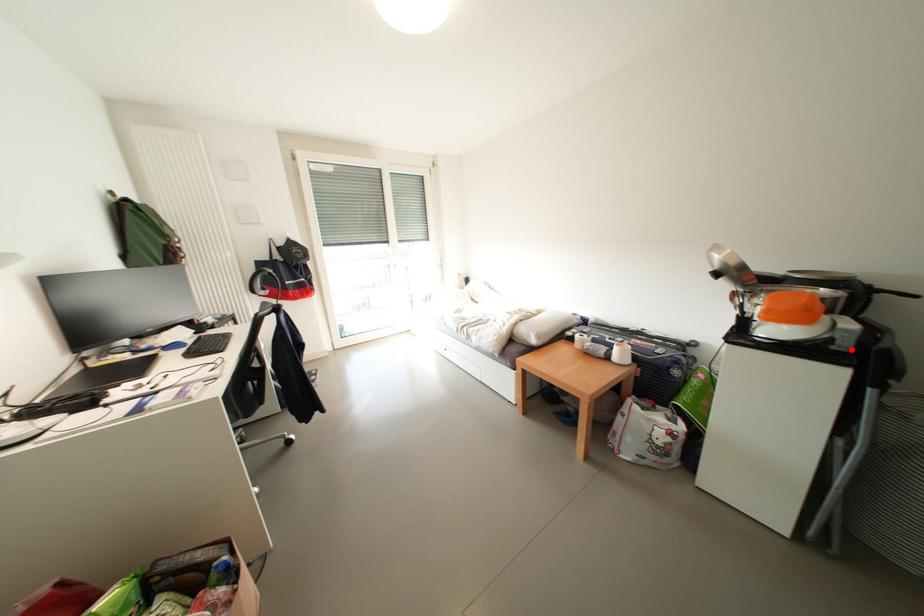
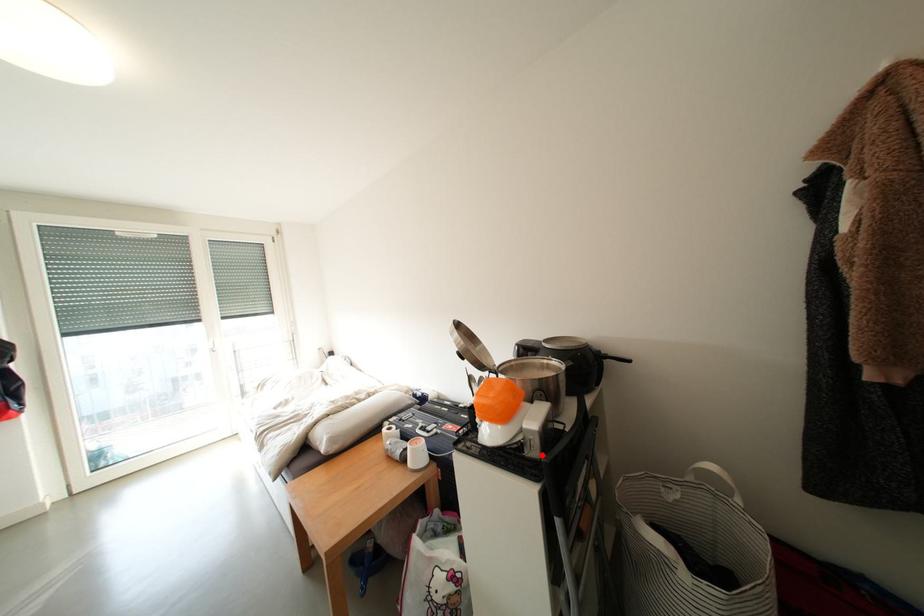
I am providing you with two images of the same scene from different viewpoints. A red point is marked on the first image and another point is marked on the second image. Do the highlighted points in image1 and image2 indicate the same real-world spot?

Yes